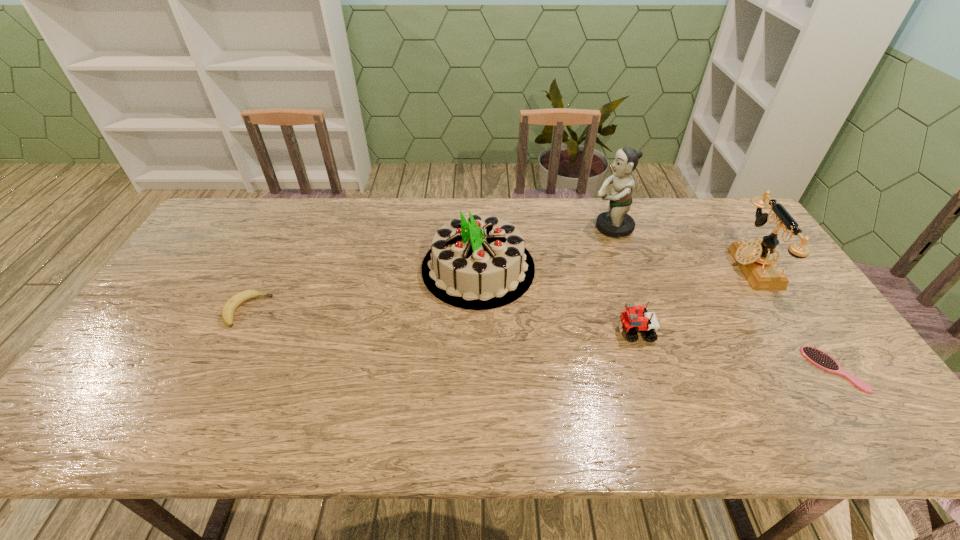
I want to click on vacant space located on the front-facing side of the tallest object, so (566, 227).

You are a GUI agent. You are given a task and a screenshot of the screen. Output one action in this format:
    pyautogui.click(x=<x>, y=<y>)
    Task: Click on the free spot located on the left of the birthday cake
    This screenshot has width=960, height=540.
    Given the screenshot: What is the action you would take?
    pyautogui.click(x=405, y=268)

Identify the location of free point located 0.360m on the dial of the telephone. (614, 267).

This screenshot has width=960, height=540. In order to click on free point located on the dial of the telephone in this screenshot , I will do `click(644, 267)`.

Where is `vacant space located on the dial of the telephone`? The width and height of the screenshot is (960, 540). vacant space located on the dial of the telephone is located at coordinates (673, 267).

Locate an element on the screen. free space located 0.390m on the front-facing side of the fourth tallest object is located at coordinates (471, 332).

Where is `free region located on the front-facing side of the fourth tallest object`? This screenshot has height=540, width=960. free region located on the front-facing side of the fourth tallest object is located at coordinates (486, 332).

Where is `vacant space positioned on the front-facing side of the fourth tallest object`? vacant space positioned on the front-facing side of the fourth tallest object is located at coordinates (497, 332).

The height and width of the screenshot is (540, 960). What are the coordinates of `blank area located on the front of the banana` in the screenshot? It's located at (219, 366).

Where is `vacant space located on the back of the shortest object`? vacant space located on the back of the shortest object is located at coordinates (804, 326).